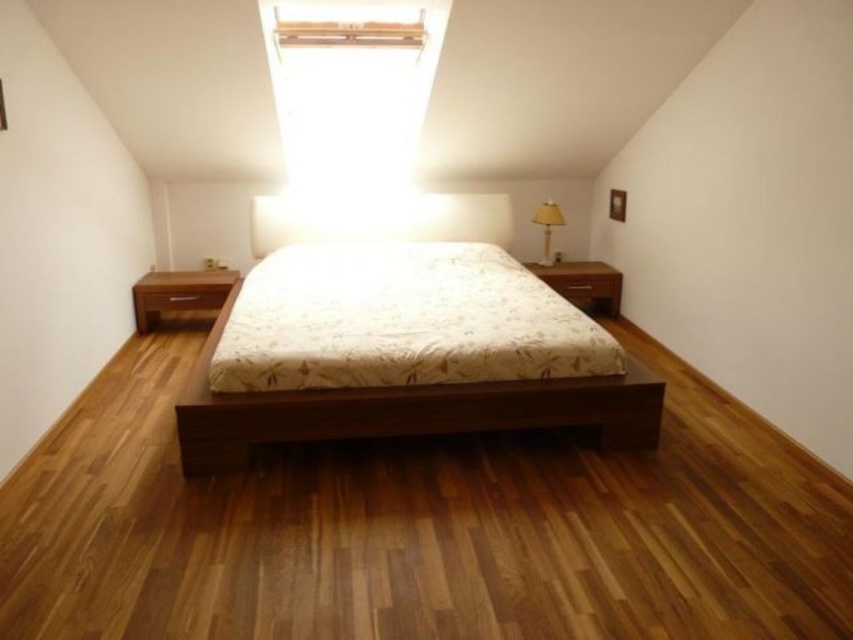
You are moving a small box that is 30 cm wide. You see the brown wood dresser at right and the yellow fabric lampshade at right in the bedroom. Which object can the box fit under if the space under each is proportional to their size?

The brown wood dresser at right is larger in size than the yellow fabric lampshade at right, so the box can fit under the brown wood dresser at right since it has a larger space underneath.

You are standing in the minimalist bedroom and want to determine which of the two points, point (x=561, y=264) or point (x=595, y=296), is closer to you. Based on the scene, which point is nearer?

Point (x=561, y=264) is closer to you because it is further to the camera than point (x=595, y=296).

You are moving a small 2.5 inch wide decorative item from the brown wood dresser at right to the brown matte drawer at right. Can it fit between them without overlapping?

The distance between the brown wood dresser at right and the brown matte drawer at right is 2.34 inches, which is slightly less than the 2.5 inch width of the item. Therefore, the decorative item cannot fit between them without overlapping.